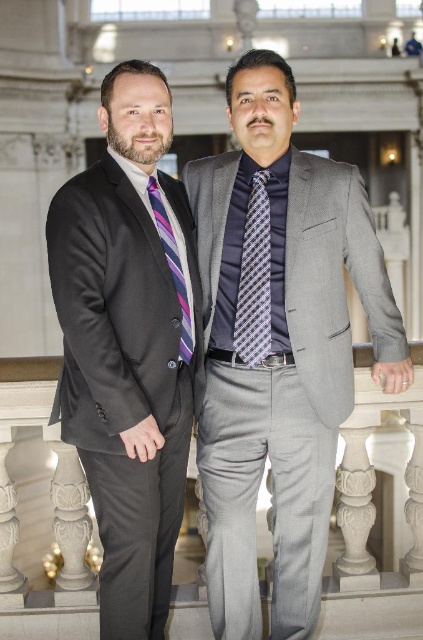
Question: Is matte black suit at left above white marble balustrade at lower center?

Choices:
 (A) yes
 (B) no

Answer: (A)

Question: Among these objects, which one is nearest to the camera?

Choices:
 (A) striped silk tie at center
 (B) white marble balustrade at lower center
 (C) matte black suit at left
 (D) navy satin tie at center

Answer: (C)

Question: Which point is farther to the camera?

Choices:
 (A) (129, 564)
 (B) (236, 310)

Answer: (B)

Question: Does white marble balustrade at lower center come in front of navy satin tie at center?

Choices:
 (A) yes
 (B) no

Answer: (A)

Question: Can you confirm if white marble balustrade at lower center is wider than navy satin tie at center?

Choices:
 (A) no
 (B) yes

Answer: (B)

Question: Among these points, which one is nearest to the camera?

Choices:
 (A) (197, 628)
 (B) (161, 228)
 (C) (60, 417)

Answer: (C)